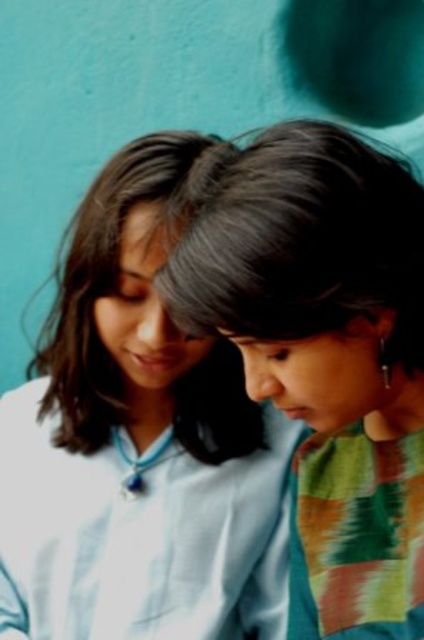
Question: Can you confirm if white glossy shirt at center is positioned to the left of smooth black hair at center?

Choices:
 (A) yes
 (B) no

Answer: (A)

Question: Does white glossy shirt at center appear over smooth black hair at center?

Choices:
 (A) no
 (B) yes

Answer: (A)

Question: Is white glossy shirt at center bigger than smooth black hair at center?

Choices:
 (A) yes
 (B) no

Answer: (A)

Question: Which point is closer to the camera taking this photo?

Choices:
 (A) (329, 484)
 (B) (192, 596)

Answer: (A)

Question: Which of the following is the farthest from the observer?

Choices:
 (A) smooth black hair at center
 (B) white glossy shirt at center

Answer: (B)